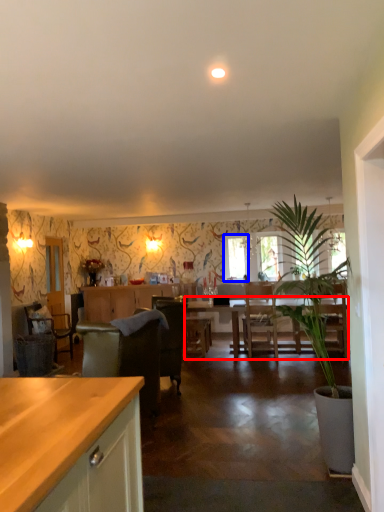
Question: Which of the following is the closest to the observer, kitchen & dining room table (highlighted by a red box) or window screen (highlighted by a blue box)?

Choices:
 (A) kitchen & dining room table
 (B) window screen

Answer: (A)